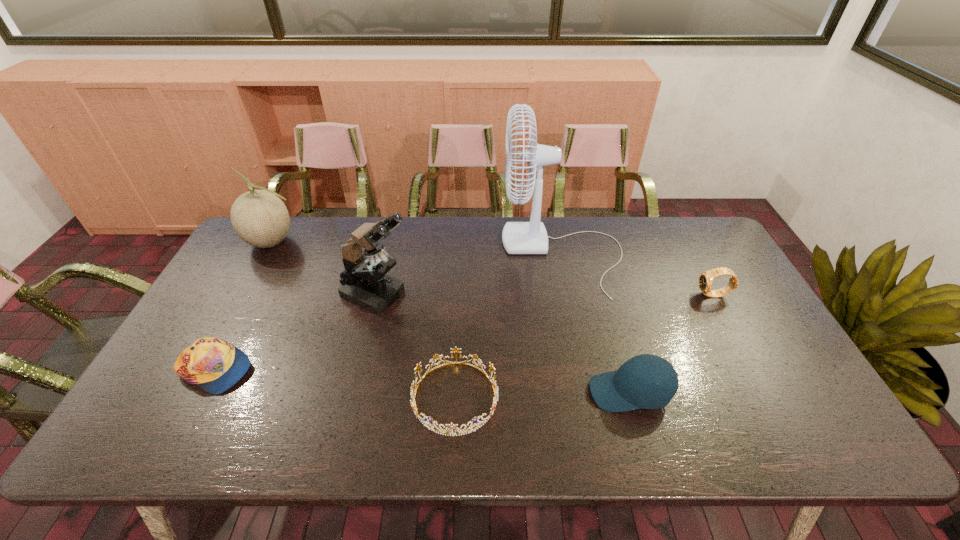
I want to click on vacant point at the right edge, so click(x=685, y=268).

The height and width of the screenshot is (540, 960). I want to click on free space at the far left corner, so click(x=270, y=255).

This screenshot has width=960, height=540. Find the location of `vacant space at the far right corner of the desktop`. vacant space at the far right corner of the desktop is located at coordinates (677, 257).

Where is `empty space that is in between the fourth object from right to left and the cap`? empty space that is in between the fourth object from right to left and the cap is located at coordinates (335, 384).

Identify the location of vacant area that lies between the cap and the tallest object. (389, 312).

This screenshot has width=960, height=540. I want to click on vacant area that lies between the cantaloup and the fifth object from right to left, so click(324, 267).

Find the location of a particular element. empty location between the fourth object from left to right and the cap is located at coordinates (335, 384).

Locate an element on the screen. This screenshot has width=960, height=540. free space between the watch and the tallest object is located at coordinates tap(638, 274).

Identify the location of free space between the cap and the fourth object from left to right. The width and height of the screenshot is (960, 540). (335, 384).

What are the coordinates of `empty space that is in between the cap and the second tallest object` in the screenshot? It's located at (296, 332).